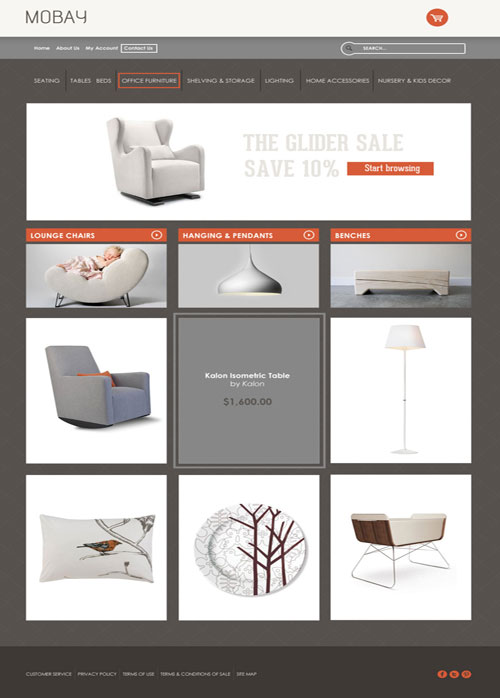
This screenshot has height=698, width=500. I want to click on overhead lamp, so click(270, 283).